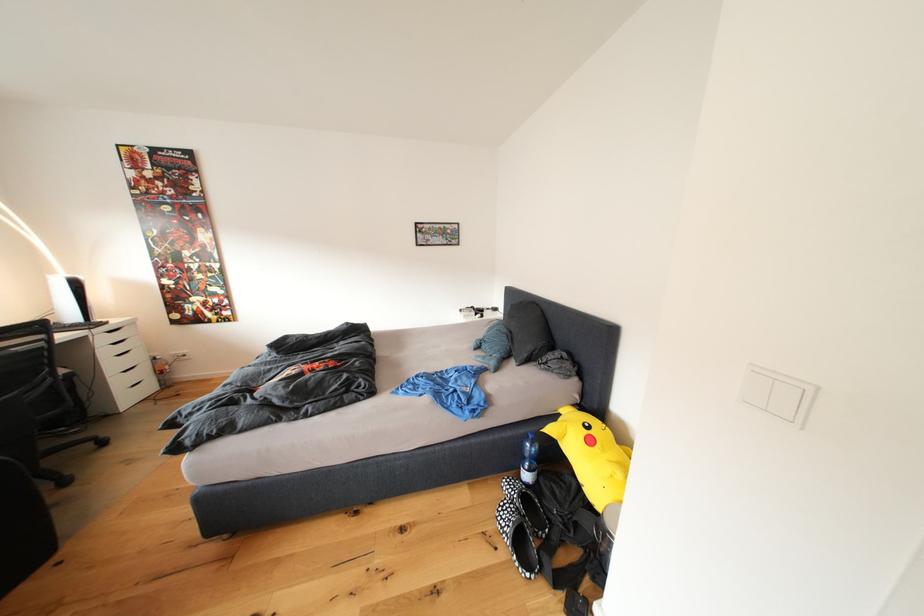
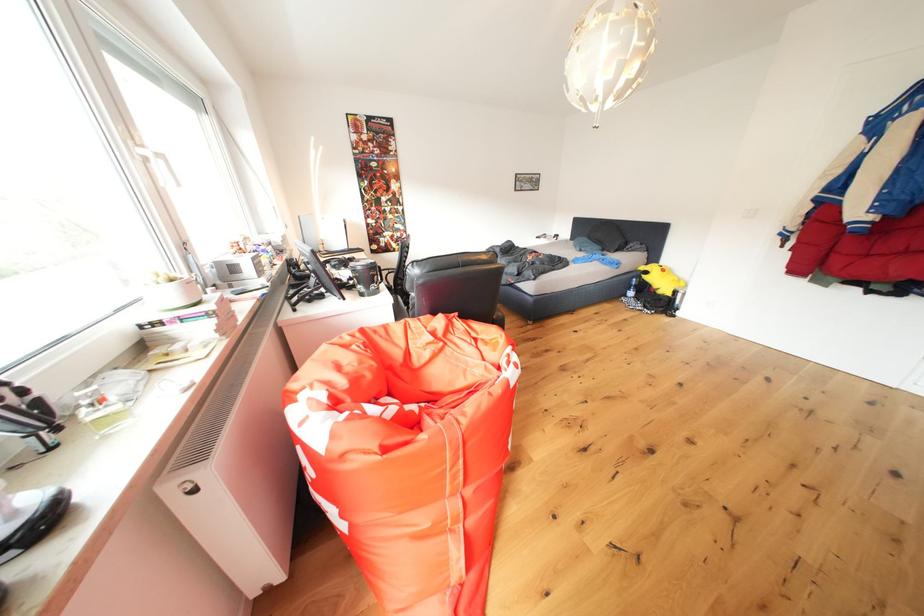
The images are taken continuously from a first-person perspective. In which direction are you moving?

The cameraman walked toward left, backward.